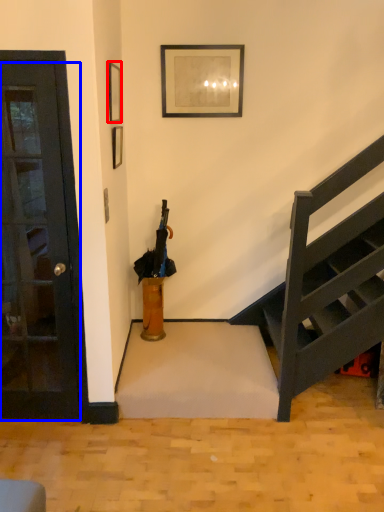
Question: Which point is further to the camera, picture frame (highlighted by a red box) or door (highlighted by a blue box)?

Choices:
 (A) picture frame
 (B) door

Answer: (A)